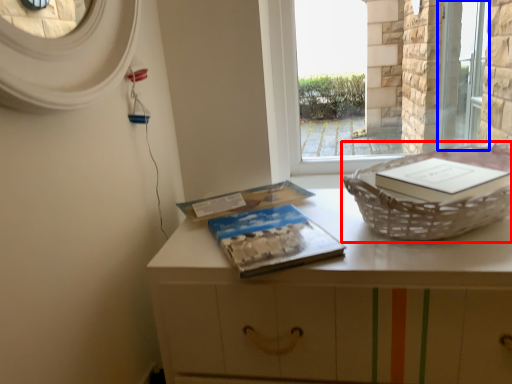
Question: Which point is further to the camera, basket container (highlighted by a red box) or screen door (highlighted by a blue box)?

Choices:
 (A) basket container
 (B) screen door

Answer: (B)